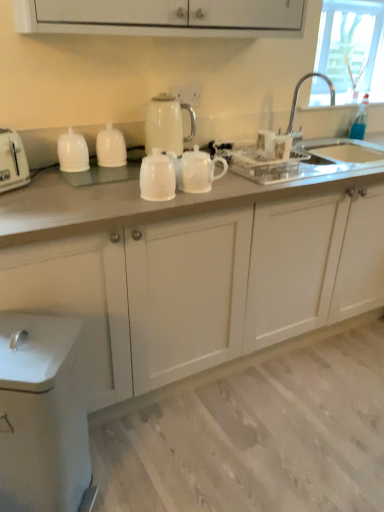
What do you see at coordinates (12, 161) in the screenshot?
I see `white plastic toaster at left` at bounding box center [12, 161].

At what (x,y) coordinates should I click in order to perform the action: click on white glossy teapot at center. Please return your answer as a coordinate pair (x, y). The image size is (384, 512). Looking at the image, I should click on (196, 170).

The height and width of the screenshot is (512, 384). Find the location of `blue glass bottle at upper right`. blue glass bottle at upper right is located at coordinates (360, 120).

In order to face white glossy cups at center, which is the 3th tableware in right-to-left order, should I rotate leftwards or rightwards?

Rotate your view left by about 15.120°.

I want to click on white matte teapot at center, the first tableware viewed from the right, so click(157, 177).

Measure the distance between white matte teapot at center, the 3th tableware positioned from the left, and camera.

The distance of white matte teapot at center, the 3th tableware positioned from the left, from camera is 4.42 feet.

Where is `white plastic toaster at left`? Image resolution: width=384 pixels, height=512 pixels. white plastic toaster at left is located at coordinates (12, 161).

Is point (330, 98) less distant than point (337, 250)?

No.

How many degrees apart are the facing directions of silver metallic faucet at upper right and white matte cabinet at center?

The angle between the facing direction of silver metallic faucet at upper right and the facing direction of white matte cabinet at center is 0.00995 degrees.

Considering the sizes of objects silver metallic faucet at upper right and white matte cabinet at center in the image provided, who is taller, silver metallic faucet at upper right or white matte cabinet at center?

Standing taller between the two is white matte cabinet at center.

Is silver metallic faucet at upper right looking in the opposite direction of white matte cabinet at center?

No.

Is white matte teapot at center, the first tableware viewed from the right, positioned far away from transparent glass window at upper right?

That's right, there is a large distance between white matte teapot at center, the first tableware viewed from the right, and transparent glass window at upper right.

From a real-world perspective, which object rests below the other?

white matte teapot at center, the 3th tableware positioned from the left.

Between point (157, 198) and point (315, 84), which one is positioned in front?

Point (157, 198)

From the image's perspective, is blue glass bottle at upper right located above white plastic toaster at left?

Yes, from the image's perspective, blue glass bottle at upper right is on top of white plastic toaster at left.

From a real-world perspective, between blue glass bottle at upper right and white plastic toaster at left, who is vertically higher?

From a 3D spatial view, white plastic toaster at left is above.

Which object is closer to the camera taking this photo, blue glass bottle at upper right or white plastic toaster at left?

white plastic toaster at left is closer to the camera.

Can you see blue glass bottle at upper right touching white plastic toaster at left?

No, blue glass bottle at upper right is not beside white plastic toaster at left.

From their relative heights in the image, would you say white glossy trash can at lower left is taller or shorter than white glossy teapot at center, which is the 2th tableware from right to left?

Considering their sizes, white glossy trash can at lower left has more height than white glossy teapot at center, which is the 2th tableware from right to left.

Is white glossy trash can at lower left far from white glossy teapot at center, the 2th tableware positioned from the left?

That's not correct — white glossy trash can at lower left is a little close to white glossy teapot at center, the 2th tableware positioned from the left.

From the picture: Could white glossy teapot at center, which is the 2th tableware from right to left, be considered to be inside white glossy trash can at lower left?

No, white glossy teapot at center, which is the 2th tableware from right to left, is not a part of white glossy trash can at lower left.

Between point (54, 398) and point (117, 142), which one is positioned in front?

The point (54, 398) is more forward.

From the image's perspective, is white glossy electric kettle at upper center positioned above or below white glossy cups at center, which is the 3th tableware in right-to-left order?

From the image's perspective, white glossy electric kettle at upper center appears above white glossy cups at center, which is the 3th tableware in right-to-left order.

Considering the positions of objects white glossy electric kettle at upper center and white glossy cups at center, which is the 3th tableware in right-to-left order, in the image provided, who is more to the right, white glossy electric kettle at upper center or white glossy cups at center, which is the 3th tableware in right-to-left order,?

white glossy electric kettle at upper center is more to the right.

Which is behind, white glossy electric kettle at upper center or white glossy cups at center, the first tableware from the left?

Positioned behind is white glossy electric kettle at upper center.

This screenshot has width=384, height=512. I want to click on kitchen appliance above the white glossy teapot at center (from the image's perspective), so click(167, 124).

Considering the points (175, 170) and (181, 147), which point is behind, point (175, 170) or point (181, 147)?

Point (181, 147)

Is white glossy teapot at center next to white glossy electric kettle at upper center and touching it?

white glossy teapot at center and white glossy electric kettle at upper center are not in contact.

Does white glossy teapot at center have a lesser height compared to white glossy electric kettle at upper center?

Indeed, white glossy teapot at center has a lesser height compared to white glossy electric kettle at upper center.

Considering the relative sizes of white glossy electric kettle at upper center and white matte cabinet at center in the image provided, is white glossy electric kettle at upper center bigger than white matte cabinet at center?

Actually, white glossy electric kettle at upper center might be smaller than white matte cabinet at center.

Would you say white glossy electric kettle at upper center is inside or outside white matte cabinet at center?

white glossy electric kettle at upper center is not enclosed by white matte cabinet at center.

From the image's perspective, which is above, white glossy electric kettle at upper center or white matte cabinet at center?

white glossy electric kettle at upper center appears higher in the image.

From the picture: From their relative heights in the image, would you say white glossy electric kettle at upper center is taller or shorter than white matte cabinet at center?

Clearly, white glossy electric kettle at upper center is shorter compared to white matte cabinet at center.

The width and height of the screenshot is (384, 512). What are the coordinates of `tap located above the white matte cabinet at center (from a real-world perspective)` in the screenshot? It's located at (297, 95).

At what (x,y) coordinates should I click in order to perform the action: click on the 3rd tableware in front of the transparent glass window at upper right, starting your count from the anchor. Please return your answer as a coordinate pair (x, y). The height and width of the screenshot is (512, 384). Looking at the image, I should click on (157, 177).

Looking at this image, which object lies nearer to the anchor point white matte teapot at center, the first tableware viewed from the right, white matte cabinet at center or silver metallic faucet at upper right?

white matte cabinet at center lies closer to white matte teapot at center, the first tableware viewed from the right, than the other object.

Consider the image. When comparing their distances from white matte teapot at center, the first tableware viewed from the right, does white plastic toaster at left or blue glass bottle at upper right seem closer?

white plastic toaster at left.

Estimate the real-world distances between objects in this image. Which object is further from white glossy teapot at center, which is the 2th tableware from right to left, silver metallic faucet at upper right or transparent glass window at upper right?

transparent glass window at upper right is further to white glossy teapot at center, which is the 2th tableware from right to left.

From the image, which object appears to be farther from white matte cabinet at center, white matte teapot at center, the first tableware viewed from the right, or white glossy cups at center, which is the 3th tableware in right-to-left order?

white glossy cups at center, which is the 3th tableware in right-to-left order.

From the image, which object appears to be farther from white glossy trash can at lower left, white matte teapot at center, the first tableware viewed from the right, or white plastic toaster at left?

white plastic toaster at left.

Looking at the image, which one is located further to white glossy teapot at center, which is the 2th tableware from right to left, white glossy trash can at lower left or white matte cabinet at center?

The object further to white glossy teapot at center, which is the 2th tableware from right to left, is white glossy trash can at lower left.

Looking at the image, which one is located further to white glossy teapot at center, which is the 2th tableware from right to left, white glossy cups at center, which is the 3th tableware in right-to-left order, or white plastic toaster at left?

white plastic toaster at left is further to white glossy teapot at center, which is the 2th tableware from right to left.

Based on their spatial positions, is white glossy cups at center, the first tableware from the left, or white matte teapot at center, the first tableware viewed from the right, closer to transparent glass window at upper right?

white matte teapot at center, the first tableware viewed from the right, lies closer to transparent glass window at upper right than the other object.

Identify the location of kitchen appliance between white plastic toaster at left and white glossy teapot at center from left to right. (167, 124).

At what (x,y) coordinates should I click in order to perform the action: click on tableware situated between white glossy teapot at center, which is the 2th tableware from right to left, and transparent glass window at upper right from left to right. Please return your answer as a coordinate pair (x, y). The image size is (384, 512). Looking at the image, I should click on (157, 177).

Where is `tap between white glossy cups at center, the first tableware from the left, and transparent glass window at upper right`? The width and height of the screenshot is (384, 512). tap between white glossy cups at center, the first tableware from the left, and transparent glass window at upper right is located at coordinates pyautogui.click(x=297, y=95).

Identify the location of tea pot between white glossy electric kettle at upper center and white glossy trash can at lower left from top to bottom. (196, 170).